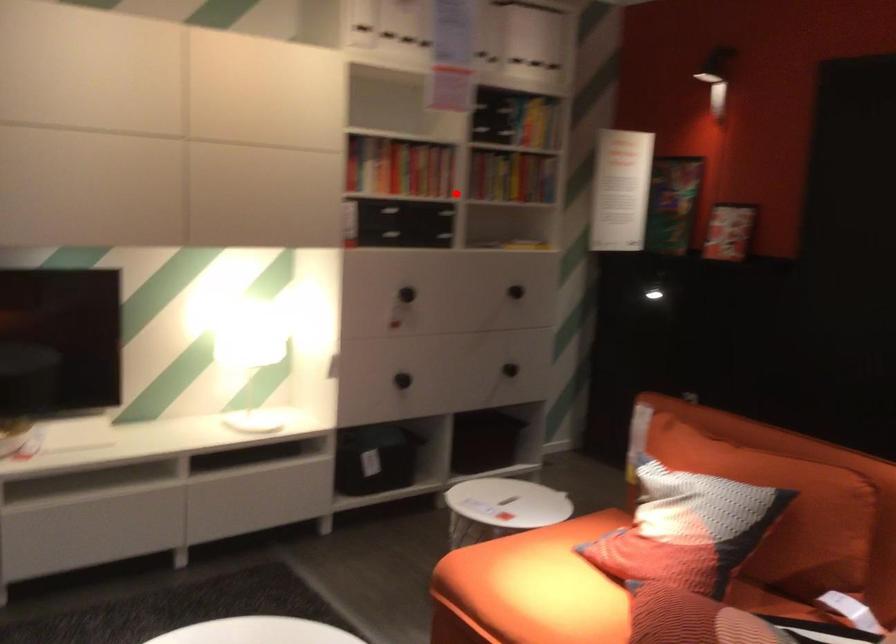
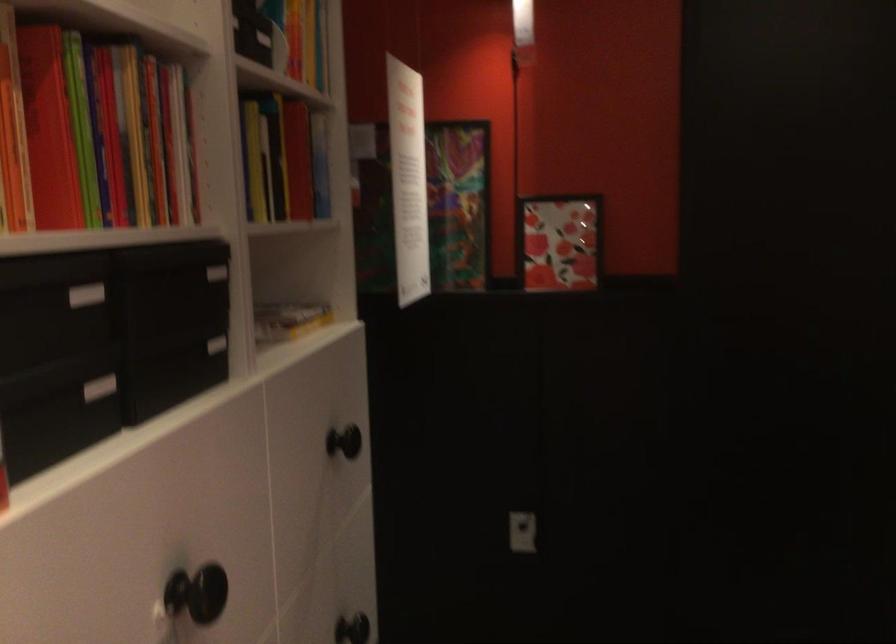
Question: I am providing you with two images of the same scene from different viewpoints. Image1 has a red point marked. In image2, the corresponding 3D location appears at what relative position? Reply with the corresponding letter.

Choices:
 (A) Closer
 (B) Farther

Answer: (A)